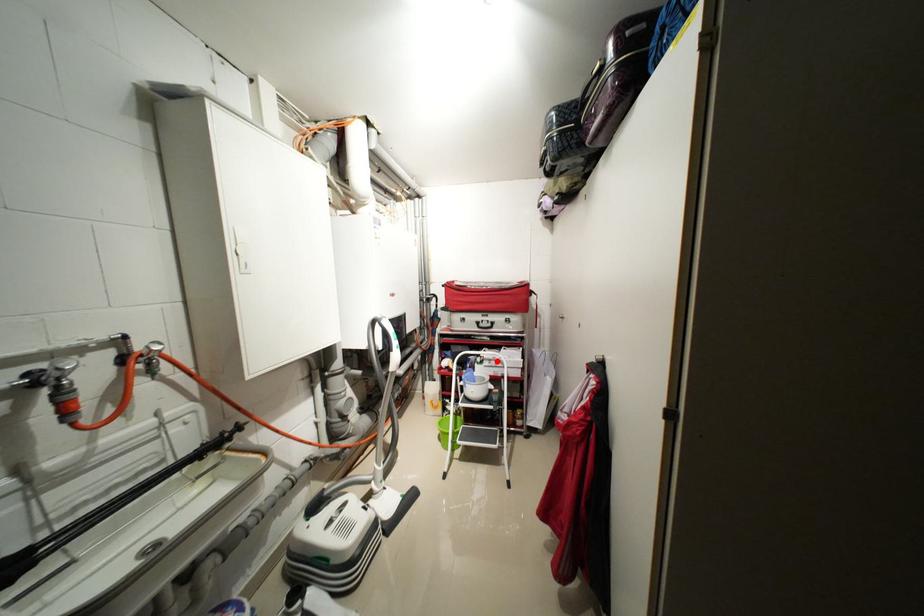
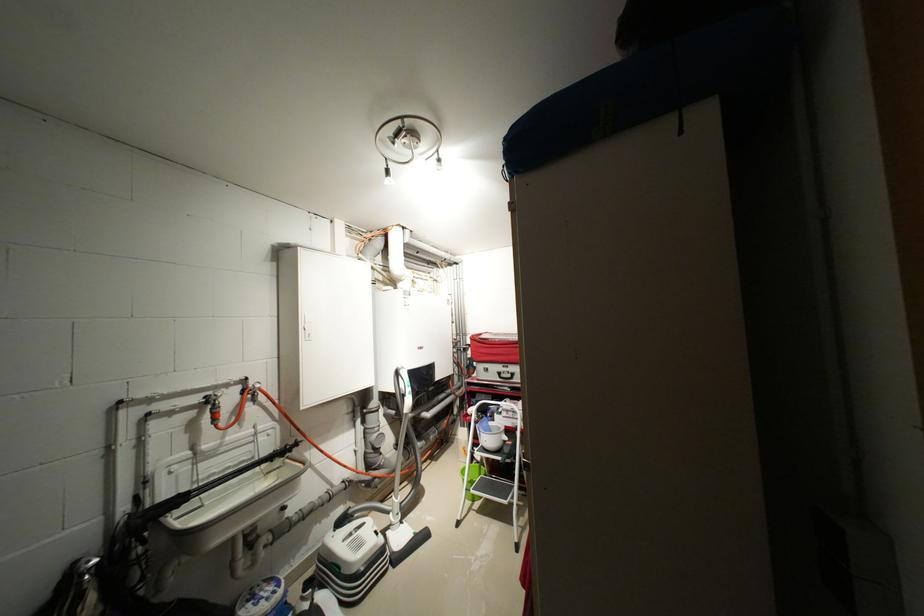
Locate, in the second image, the point that corresponds to the highlighted location in the first image.

(515, 411)